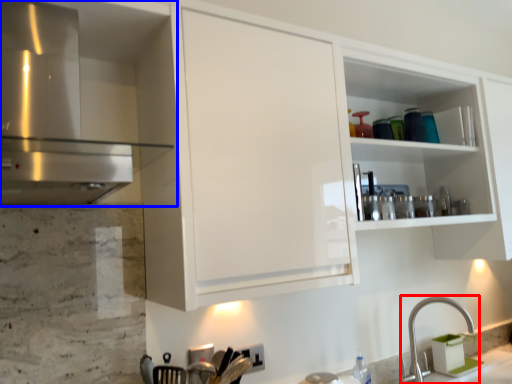
Question: Which object is closer to the camera taking this photo, tap (highlighted by a red box) or cabinetry (highlighted by a blue box)?

Choices:
 (A) tap
 (B) cabinetry

Answer: (B)